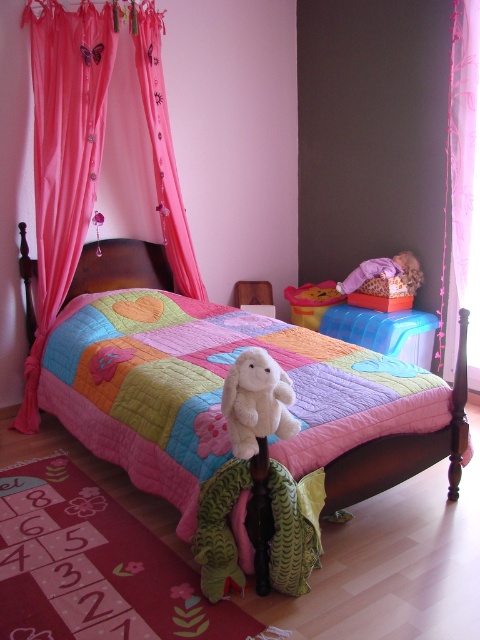
Can you confirm if pink fabric curtain at upper left is positioned to the right of white plush rabbit at center?

In fact, pink fabric curtain at upper left is to the left of white plush rabbit at center.

Is pink fabric curtain at upper left shorter than white plush rabbit at center?

No, pink fabric curtain at upper left is not shorter than white plush rabbit at center.

Does point (73, 109) come closer to viewer compared to point (238, 416)?

No, (73, 109) is further to viewer.

Identify the location of pink fabric curtain at upper left. (63, 154).

Is point (159, 141) more distant than point (324, 296)?

No, it is not.

Who is positioned more to the left, pink fabric curtain at upper left or matte yellow plastic toy at center?

Positioned to the left is pink fabric curtain at upper left.

Who is more forward, [28,0] or [300,321]?

Point [28,0] is in front.

Where is `pink fabric curtain at upper left`? This screenshot has height=640, width=480. pink fabric curtain at upper left is located at coordinates (63, 154).

Can you confirm if patchwork quilt at center is thinner than white plush rabbit at center?

Incorrect, patchwork quilt at center's width is not less than white plush rabbit at center's.

Does point (418, 460) lie behind point (249, 412)?

Yes.

Who is more forward, (x=467, y=312) or (x=254, y=449)?

Positioned in front is point (x=254, y=449).

Image resolution: width=480 pixels, height=640 pixels. What are the coordinates of `patchwork quilt at center` in the screenshot? It's located at (399, 452).